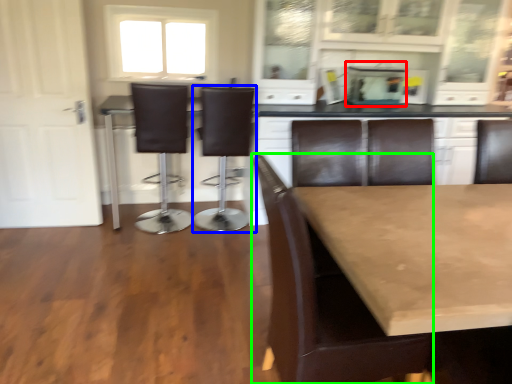
Question: Based on their relative distances, which object is nearer to appliance (highlighted by a red box)? Choose from chair (highlighted by a blue box) and chair (highlighted by a green box).

Choices:
 (A) chair
 (B) chair

Answer: (A)